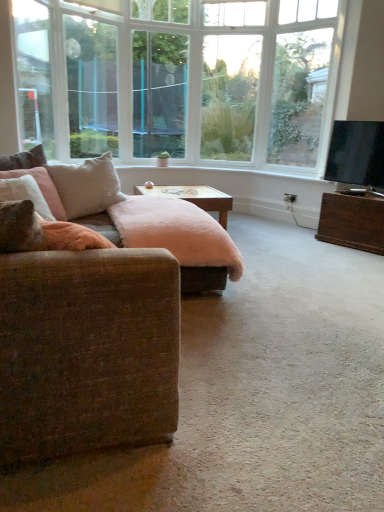
Question: Is fuzzy pink ottoman at center in contact with clear glass window screen at center, which ranks as the second window screen in left-to-right order?

Choices:
 (A) yes
 (B) no

Answer: (B)

Question: Can you confirm if fuzzy pink ottoman at center is wider than clear glass window screen at center, marked as the 1th window screen in a right-to-left arrangement?

Choices:
 (A) yes
 (B) no

Answer: (A)

Question: Can you confirm if fuzzy pink ottoman at center is thinner than clear glass window screen at center, which ranks as the second window screen in left-to-right order?

Choices:
 (A) no
 (B) yes

Answer: (A)

Question: From a real-world perspective, does fuzzy pink ottoman at center sit lower than clear glass window screen at center, marked as the 1th window screen in a right-to-left arrangement?

Choices:
 (A) no
 (B) yes

Answer: (B)

Question: From a real-world perspective, is fuzzy pink ottoman at center physically above clear glass window screen at center, marked as the 1th window screen in a right-to-left arrangement?

Choices:
 (A) no
 (B) yes

Answer: (A)

Question: Would you say fuzzy pink ottoman at center is to the left or to the right of black glossy tv at right in the picture?

Choices:
 (A) right
 (B) left

Answer: (B)

Question: Which is correct: fuzzy pink ottoman at center is inside black glossy tv at right, or outside of it?

Choices:
 (A) outside
 (B) inside

Answer: (A)

Question: Considering the positions of fuzzy pink ottoman at center and black glossy tv at right in the image, is fuzzy pink ottoman at center taller or shorter than black glossy tv at right?

Choices:
 (A) short
 (B) tall

Answer: (A)

Question: From the image's perspective, is fuzzy pink ottoman at center located above or below black glossy tv at right?

Choices:
 (A) below
 (B) above

Answer: (A)

Question: Is black glossy tv at right in front of or behind clear glass window screen at upper left, marked as the second window screen in a right-to-left arrangement, in the image?

Choices:
 (A) front
 (B) behind

Answer: (A)

Question: From the image's perspective, is black glossy tv at right positioned above or below clear glass window screen at upper left, the first window screen viewed from the left?

Choices:
 (A) below
 (B) above

Answer: (A)

Question: Considering the positions of black glossy tv at right and clear glass window screen at upper left, the first window screen viewed from the left, in the image, is black glossy tv at right wider or thinner than clear glass window screen at upper left, the first window screen viewed from the left,?

Choices:
 (A) wide
 (B) thin

Answer: (A)

Question: Considering the positions of black glossy tv at right and clear glass window screen at upper left, marked as the second window screen in a right-to-left arrangement, in the image, is black glossy tv at right taller or shorter than clear glass window screen at upper left, marked as the second window screen in a right-to-left arrangement,?

Choices:
 (A) short
 (B) tall

Answer: (A)

Question: Is clear glass window screen at center, marked as the 1th window screen in a right-to-left arrangement, spatially inside clear glass window screen at upper left, the first window screen viewed from the left, or outside of it?

Choices:
 (A) inside
 (B) outside

Answer: (B)

Question: Is point (165, 100) closer or farther from the camera than point (79, 27)?

Choices:
 (A) closer
 (B) farther

Answer: (B)